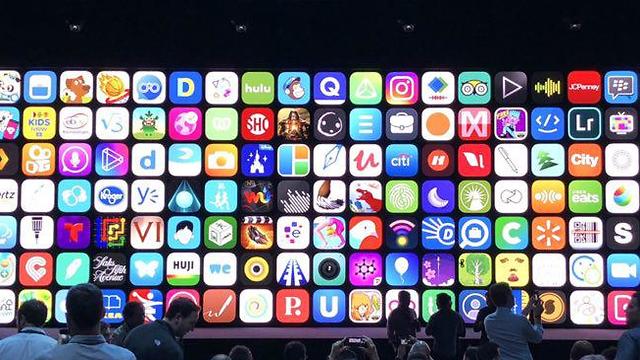
The width and height of the screenshot is (640, 360). Identify the location of lights. (72, 23), (244, 25), (406, 28), (575, 29).